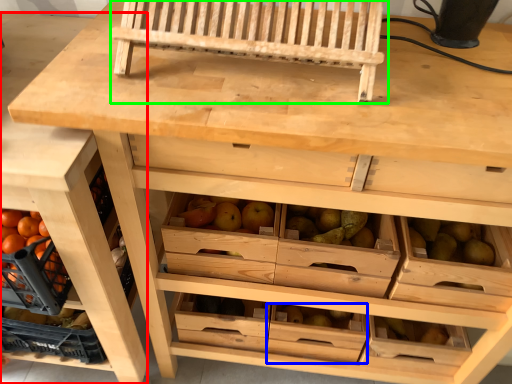
Question: Which object is the farthest from shelf (highlighted by a red box)? Choose among these: drawer (highlighted by a blue box) or church bench (highlighted by a green box).

Choices:
 (A) drawer
 (B) church bench

Answer: (A)